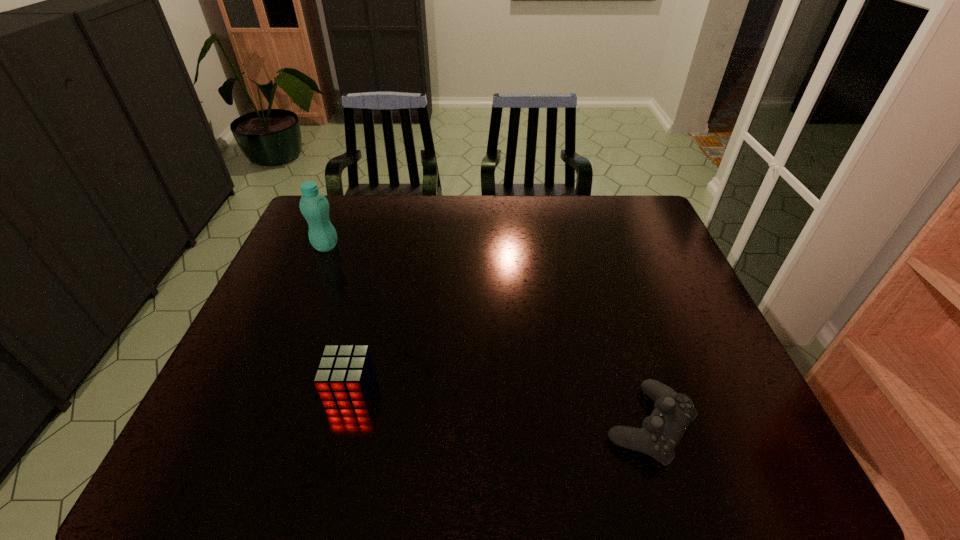
Where is `object situated at the left edge`? This screenshot has height=540, width=960. object situated at the left edge is located at coordinates (x=314, y=206).

The height and width of the screenshot is (540, 960). Identify the location of object present at the right edge. (661, 432).

You are a GUI agent. You are given a task and a screenshot of the screen. Output one action in this format:
    pyautogui.click(x=<x>, y=<y>)
    Task: Click on the object that is positioned at the near right corner
    This screenshot has height=540, width=960.
    Given the screenshot: What is the action you would take?
    pyautogui.click(x=661, y=432)

What are the coordinates of `free space at the far edge of the desktop` in the screenshot? It's located at (454, 208).

The image size is (960, 540). In order to click on free space at the near edge in this screenshot , I will do `click(605, 478)`.

Identify the location of vacant space at the left edge of the desktop. point(288,369).

In order to click on blank space at the right edge in this screenshot , I will do `click(633, 276)`.

Locate an element on the screen. This screenshot has height=540, width=960. vacant area at the far left corner is located at coordinates (335, 216).

At what (x,y) coordinates should I click in order to perform the action: click on blank region between the second object from left to right and the farthest object. Please return your answer as a coordinate pair (x, y). The width and height of the screenshot is (960, 540). Looking at the image, I should click on coord(338,318).

This screenshot has height=540, width=960. In order to click on vacant area between the control and the second shortest object in this screenshot , I will do coord(500,407).